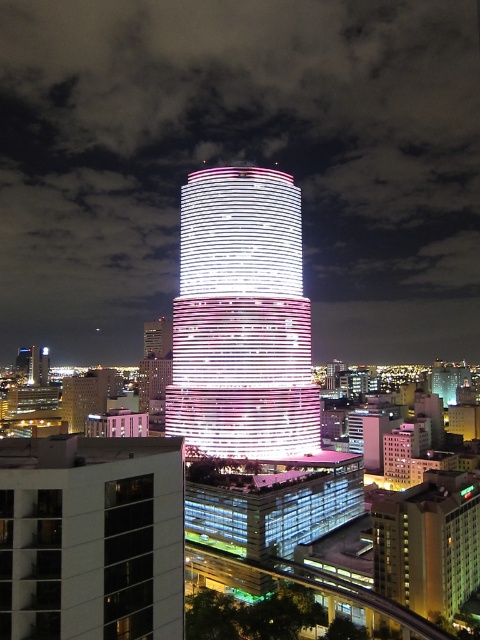
Question: Which point is farther from the camera taking this photo?

Choices:
 (A) (147, 620)
 (B) (190, 275)

Answer: (B)

Question: Which point is farther from the camera taking this photo?

Choices:
 (A) (82, 612)
 (B) (319, 449)

Answer: (B)

Question: Does white glossy tower at center appear over glassy reflective building at lower left?

Choices:
 (A) no
 (B) yes

Answer: (B)

Question: Which point is closer to the camera?

Choices:
 (A) (170, 545)
 (B) (186, 321)

Answer: (A)

Question: Does white glossy tower at center appear under glassy reflective building at lower left?

Choices:
 (A) yes
 (B) no

Answer: (B)

Question: In this image, where is white glossy tower at center located relative to glassy reflective building at lower left?

Choices:
 (A) right
 (B) left

Answer: (A)